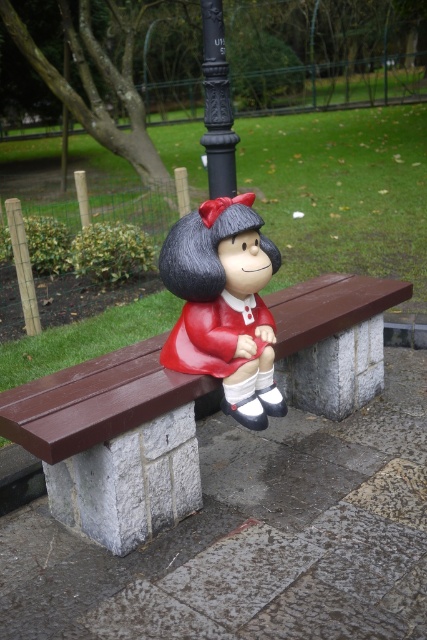
Between brown wooden bench at center and black cast iron pole at upper center, which one has more height?

With more height is black cast iron pole at upper center.

At what (x,y) coordinates should I click in order to perform the action: click on brown wooden bench at center. Please return your answer as a coordinate pair (x, y). This screenshot has height=640, width=427. Looking at the image, I should click on (113, 442).

At what (x,y) coordinates should I click in order to perform the action: click on brown wooden bench at center. Please return your answer as a coordinate pair (x, y). The image size is (427, 640). Looking at the image, I should click on (113, 442).

Is point (335, 288) farther from camera compared to point (245, 404)?

Yes, point (335, 288) is farther from viewer.

Does brown wooden bench at center have a lesser height compared to matte red plastic figurine at center?

Yes, brown wooden bench at center is shorter than matte red plastic figurine at center.

Does point (134, 410) come farther from viewer compared to point (186, 285)?

No, it is in front of (186, 285).

You are a GUI agent. You are given a task and a screenshot of the screen. Output one action in this format:
    pyautogui.click(x=<x>, y=<y>)
    Task: Click on the brown wooden bench at center
    The image size is (427, 640).
    Given the screenshot: What is the action you would take?
    pyautogui.click(x=113, y=442)

Can you confirm if matte red plastic figurine at center is positioned below black cast iron pole at upper center?

Yes, matte red plastic figurine at center is below black cast iron pole at upper center.

Does point (231, 392) lie behind point (221, 36)?

No, it is in front of (221, 36).

Is point (192, 312) positioned in front of point (228, 195)?

Yes.

The image size is (427, 640). Find the location of `matte red plastic figurine at center`. matte red plastic figurine at center is located at coordinates (224, 305).